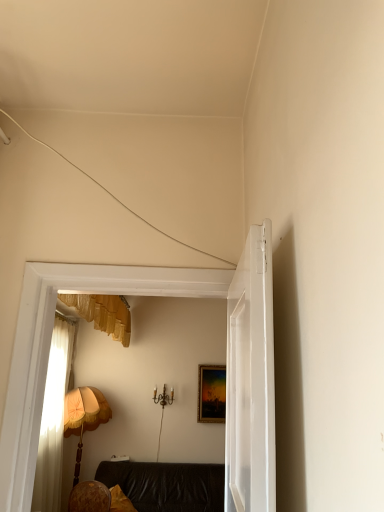
Question: Considering the relative sizes of white glossy door at center and gold-framed painting at center in the image provided, is white glossy door at center bigger than gold-framed painting at center?

Choices:
 (A) no
 (B) yes

Answer: (B)

Question: Is white glossy door at center oriented towards gold-framed painting at center?

Choices:
 (A) yes
 (B) no

Answer: (B)

Question: From a real-world perspective, is white glossy door at center beneath gold-framed painting at center?

Choices:
 (A) yes
 (B) no

Answer: (B)

Question: Is white glossy door at center to the right of gold-framed painting at center from the viewer's perspective?

Choices:
 (A) no
 (B) yes

Answer: (A)

Question: From the image's perspective, is white glossy door at center under gold-framed painting at center?

Choices:
 (A) yes
 (B) no

Answer: (B)

Question: Considering the relative positions of yellow fabric pillow at lower left and gold-framed painting at center in the image provided, is yellow fabric pillow at lower left to the left or to the right of gold-framed painting at center?

Choices:
 (A) right
 (B) left

Answer: (B)

Question: Is point (120, 489) closer or farther from the camera than point (210, 385)?

Choices:
 (A) farther
 (B) closer

Answer: (B)

Question: Relative to gold-framed painting at center, is yellow fabric pillow at lower left in front or behind?

Choices:
 (A) front
 (B) behind

Answer: (A)

Question: Is yellow fabric pillow at lower left wider or thinner than gold-framed painting at center?

Choices:
 (A) thin
 (B) wide

Answer: (B)

Question: From the image's perspective, relative to leather couch at center, is gold-framed painting at center above or below?

Choices:
 (A) below
 (B) above

Answer: (B)

Question: Is gold-framed painting at center to the left or to the right of leather couch at center in the image?

Choices:
 (A) left
 (B) right

Answer: (B)

Question: Considering the positions of point (215, 421) and point (193, 495), is point (215, 421) closer or farther from the camera than point (193, 495)?

Choices:
 (A) farther
 (B) closer

Answer: (A)

Question: Considering the positions of gold-framed painting at center and leather couch at center in the image, is gold-framed painting at center wider or thinner than leather couch at center?

Choices:
 (A) wide
 (B) thin

Answer: (B)

Question: Looking at their shapes, would you say wooden fabric lampshade at left is wider or thinner than leather couch at center?

Choices:
 (A) wide
 (B) thin

Answer: (B)

Question: Considering the positions of point tap(87, 414) and point tap(112, 474), is point tap(87, 414) closer or farther from the camera than point tap(112, 474)?

Choices:
 (A) farther
 (B) closer

Answer: (B)